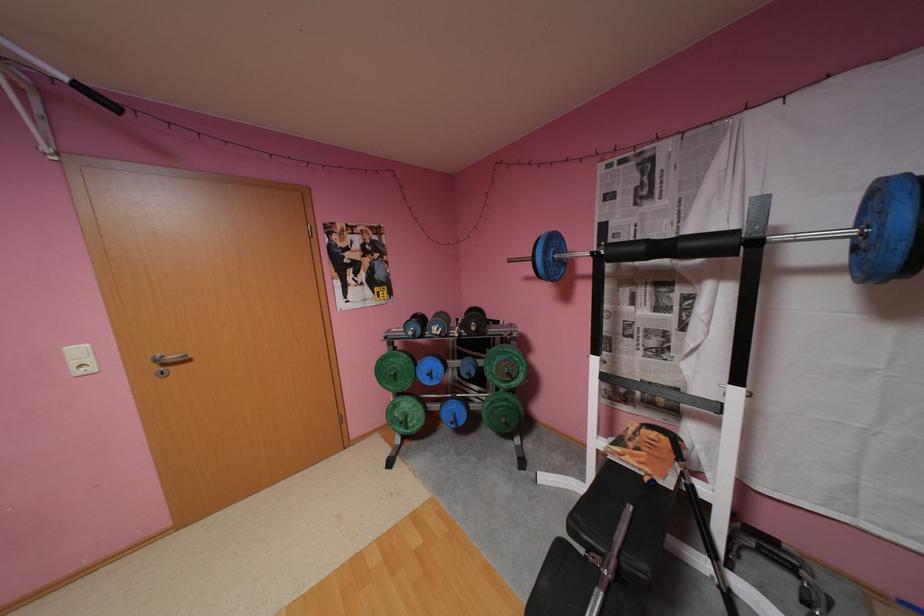
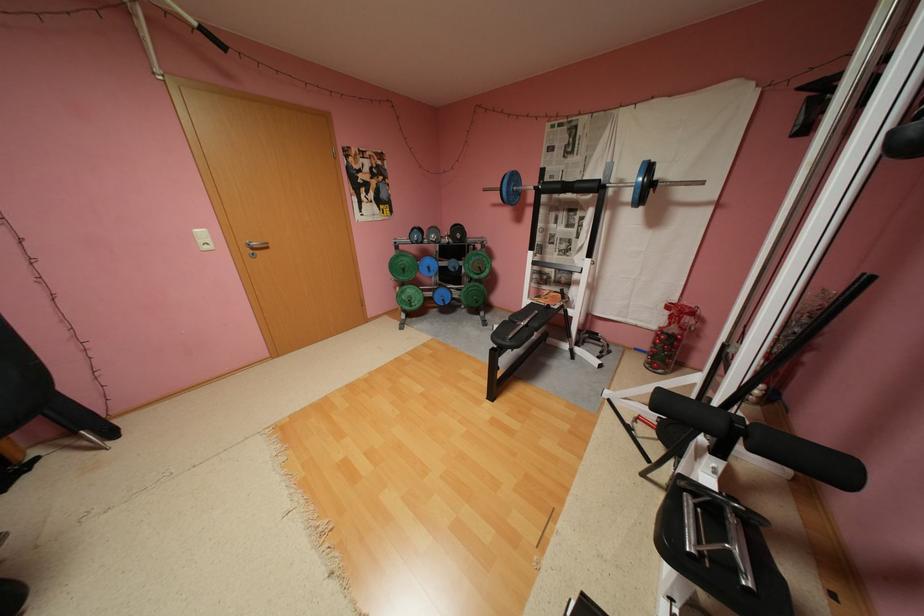
In the second image, find the point that corresponds to the point at 174,365 in the first image.

(262, 249)